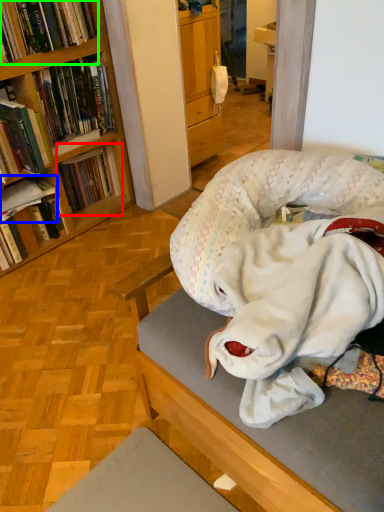
Question: Which object is the closest to the book (highlighted by a red box)? Choose among these: book (highlighted by a blue box) or book (highlighted by a green box).

Choices:
 (A) book
 (B) book

Answer: (A)